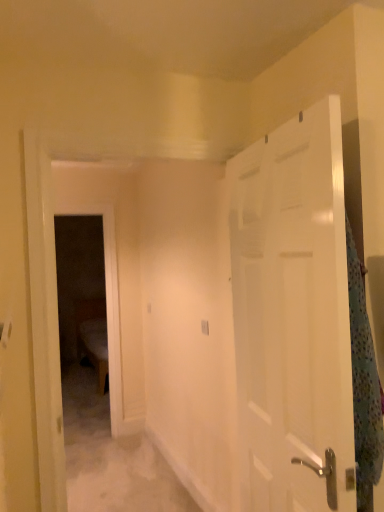
Question: In the image, is white glossy door at right positioned in front of or behind fluffy polka dot blanket at right?

Choices:
 (A) behind
 (B) front

Answer: (B)

Question: Considering the positions of point pyautogui.click(x=329, y=323) and point pyautogui.click(x=374, y=360), is point pyautogui.click(x=329, y=323) closer or farther from the camera than point pyautogui.click(x=374, y=360)?

Choices:
 (A) farther
 (B) closer

Answer: (B)

Question: From a real-world perspective, is white glossy door at right physically located above or below fluffy polka dot blanket at right?

Choices:
 (A) above
 (B) below

Answer: (A)

Question: Considering the positions of fluffy polka dot blanket at right and white glossy door at right in the image, is fluffy polka dot blanket at right bigger or smaller than white glossy door at right?

Choices:
 (A) small
 (B) big

Answer: (A)

Question: Considering the positions of point (355, 260) and point (334, 239), is point (355, 260) closer or farther from the camera than point (334, 239)?

Choices:
 (A) closer
 (B) farther

Answer: (B)

Question: Is fluffy polka dot blanket at right taller or shorter than white glossy door at right?

Choices:
 (A) tall
 (B) short

Answer: (B)

Question: Is fluffy polka dot blanket at right to the left or to the right of white glossy door at right in the image?

Choices:
 (A) left
 (B) right

Answer: (B)